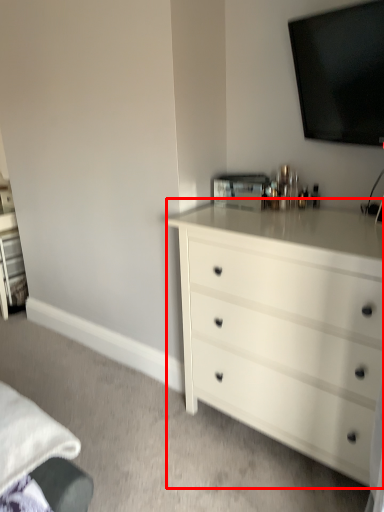
Question: Considering the relative positions of chest of drawers (annotated by the red box) and television in the image provided, where is chest of drawers (annotated by the red box) located with respect to the staircase?

Choices:
 (A) right
 (B) left

Answer: (B)